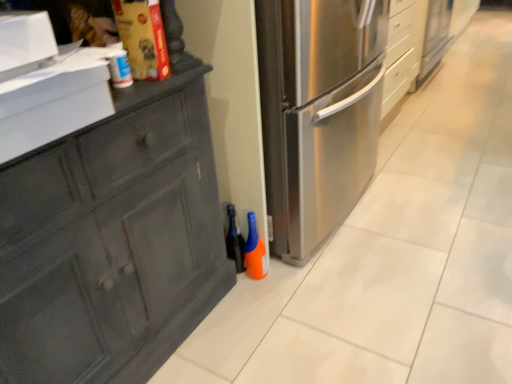
Question: From the image's perspective, is translucent orange spray bottle at lower center, the 2th bottle from the right, on top of orange matte bottle at lower center, which ranks as the second bottle in left-to-right order?

Choices:
 (A) no
 (B) yes

Answer: (B)

Question: Is translucent orange spray bottle at lower center, the 2th bottle from the right, positioned in front of orange matte bottle at lower center, which ranks as the second bottle in left-to-right order?

Choices:
 (A) yes
 (B) no

Answer: (B)

Question: From the image's perspective, is translucent orange spray bottle at lower center, which is the first bottle from left to right, below orange matte bottle at lower center, which is the first bottle in right-to-left order?

Choices:
 (A) yes
 (B) no

Answer: (B)

Question: From a real-world perspective, is translucent orange spray bottle at lower center, the 2th bottle from the right, positioned over orange matte bottle at lower center, which is the first bottle in right-to-left order, based on gravity?

Choices:
 (A) yes
 (B) no

Answer: (A)

Question: Is translucent orange spray bottle at lower center, the 2th bottle from the right, not inside orange matte bottle at lower center, which ranks as the second bottle in left-to-right order?

Choices:
 (A) no
 (B) yes

Answer: (B)

Question: Considering the relative sizes of translucent orange spray bottle at lower center, the 2th bottle from the right, and orange matte bottle at lower center, which is the first bottle in right-to-left order, in the image provided, is translucent orange spray bottle at lower center, the 2th bottle from the right, shorter than orange matte bottle at lower center, which is the first bottle in right-to-left order,?

Choices:
 (A) yes
 (B) no

Answer: (B)

Question: Is the depth of orange matte bottle at lower center, which ranks as the second bottle in left-to-right order, less than that of translucent orange spray bottle at lower center, which is the first bottle from left to right?

Choices:
 (A) yes
 (B) no

Answer: (A)

Question: Is orange matte bottle at lower center, which ranks as the second bottle in left-to-right order, bigger than translucent orange spray bottle at lower center, the 2th bottle from the right?

Choices:
 (A) yes
 (B) no

Answer: (B)

Question: Is orange matte bottle at lower center, which ranks as the second bottle in left-to-right order, located outside translucent orange spray bottle at lower center, the 2th bottle from the right?

Choices:
 (A) yes
 (B) no

Answer: (A)

Question: From the image's perspective, does orange matte bottle at lower center, which is the first bottle in right-to-left order, appear lower than translucent orange spray bottle at lower center, the 2th bottle from the right?

Choices:
 (A) no
 (B) yes

Answer: (B)

Question: Is orange matte bottle at lower center, which is the first bottle in right-to-left order, next to translucent orange spray bottle at lower center, which is the first bottle from left to right, and touching it?

Choices:
 (A) no
 (B) yes

Answer: (B)

Question: From a real-world perspective, is orange matte bottle at lower center, which is the first bottle in right-to-left order, beneath translucent orange spray bottle at lower center, the 2th bottle from the right?

Choices:
 (A) no
 (B) yes

Answer: (B)

Question: Is orange matte bottle at lower center, which ranks as the second bottle in left-to-right order, taller or shorter than translucent orange spray bottle at lower center, which is the first bottle from left to right?

Choices:
 (A) tall
 (B) short

Answer: (B)